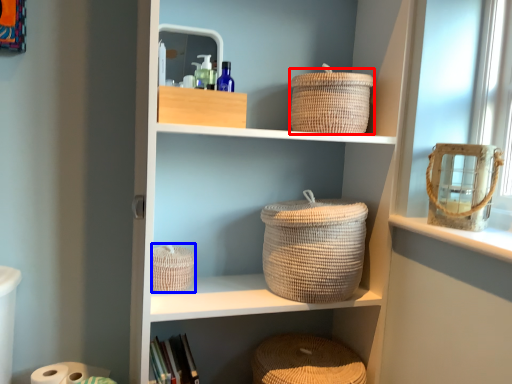
Question: Which object appears closest to the camera in this image, basket (highlighted by a red box) or basket (highlighted by a blue box)?

Choices:
 (A) basket
 (B) basket

Answer: (A)